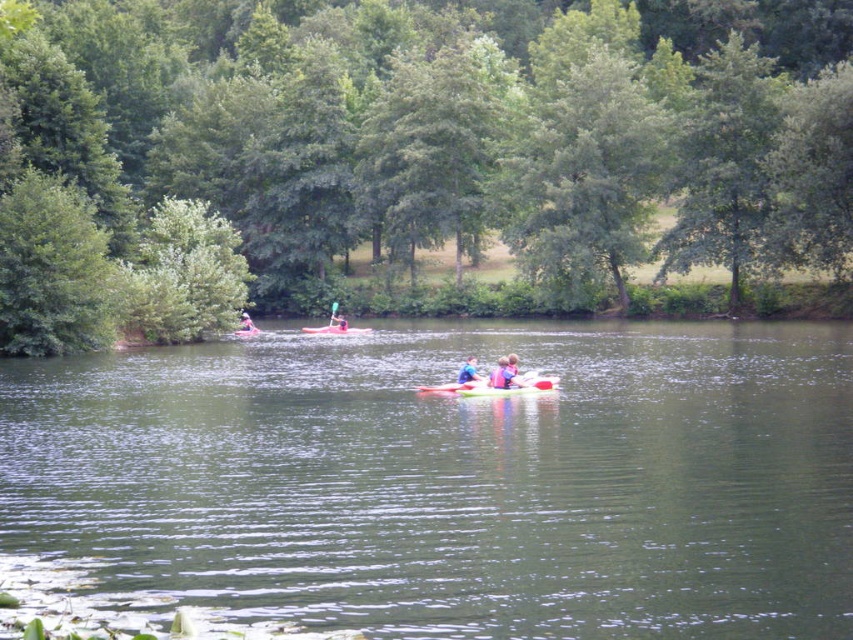
In the scene shown: You are standing on the lakeside dock and see the blue fabric kayak at center and the pink fabric kayak at center. Which kayak is positioned to the right side from your perspective?

The blue fabric kayak at center is to the right of the pink fabric kayak at center.

You are planning to take a photo of the blue fabric person at center and the pink fabric kayak at center. Based on their sizes in the image, which one would appear larger in the photo?

The pink fabric kayak at center appears larger in the photo because the blue fabric person at center is smaller than the pink fabric kayak at center according to the description.

You are standing on the lakeside and see the green smooth water at center and the matte pink kayak at center. Which object is positioned to the right side from your perspective?

The green smooth water at center is positioned to the right of the matte pink kayak at center.